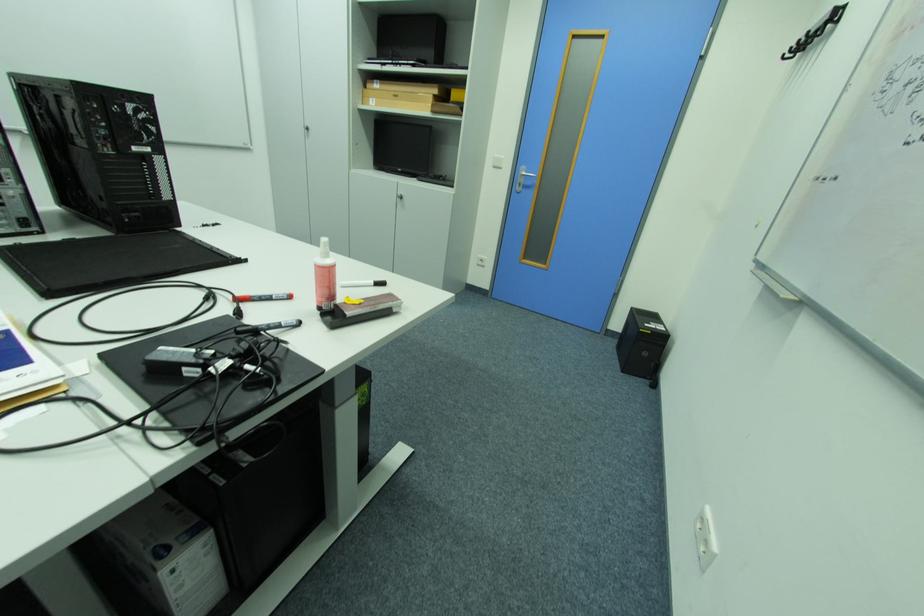
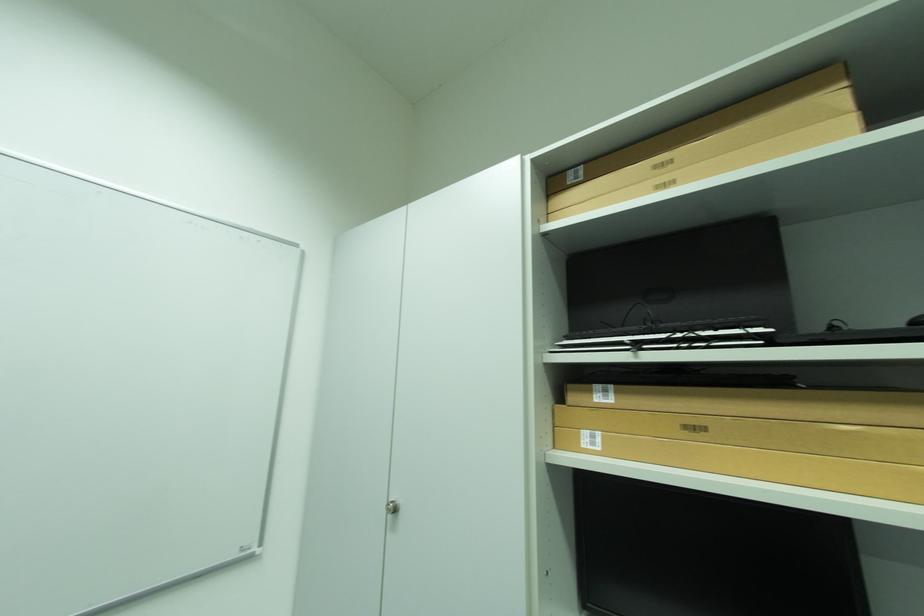
Where in the second image is the point corresponding to point 385,84 from the first image?

(614, 392)